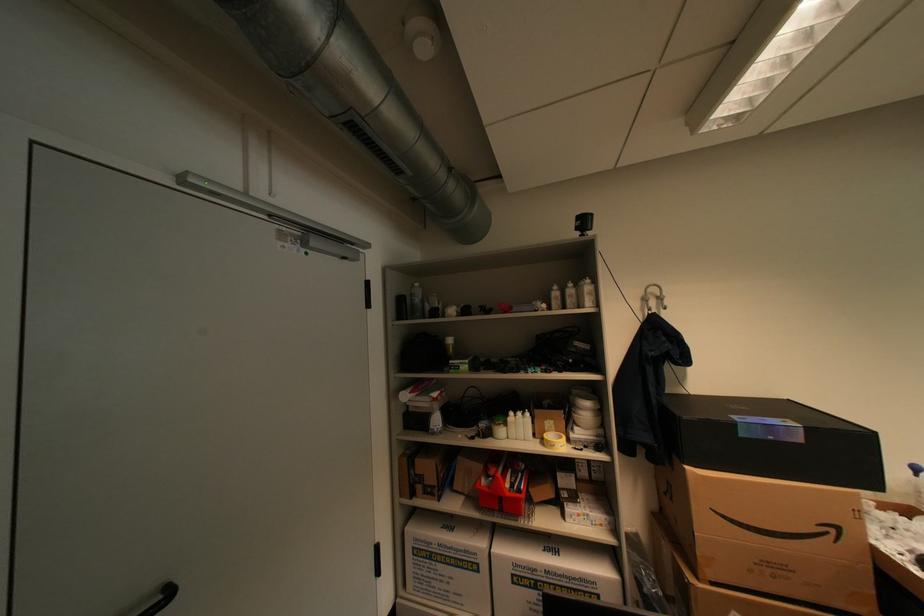
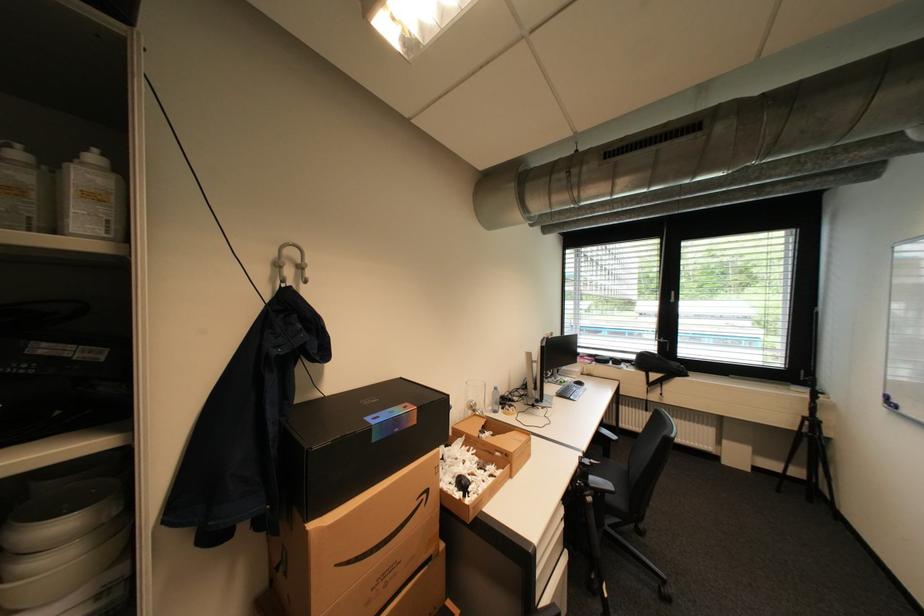
Find the pixel in the second image that matches pixel 780 438 in the first image.

(405, 431)